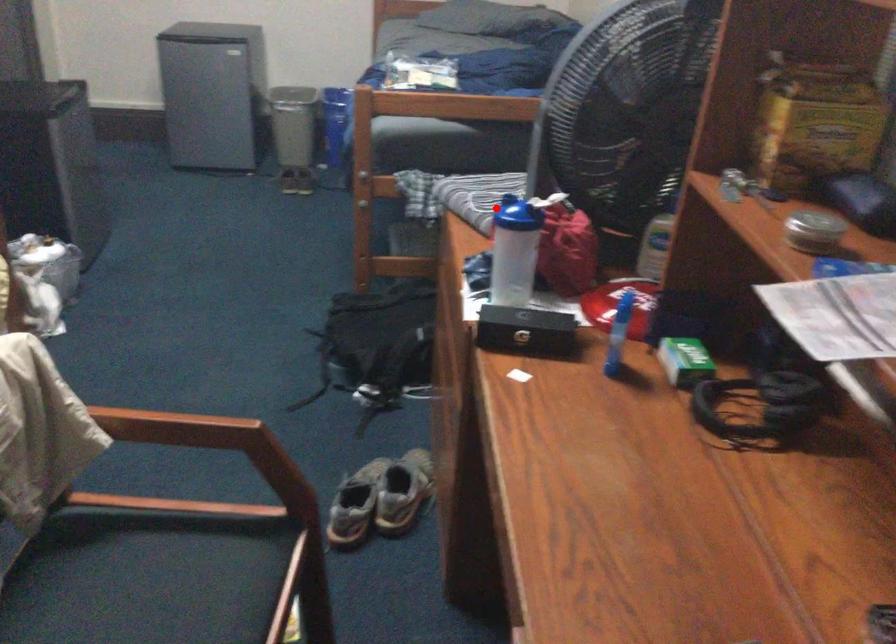
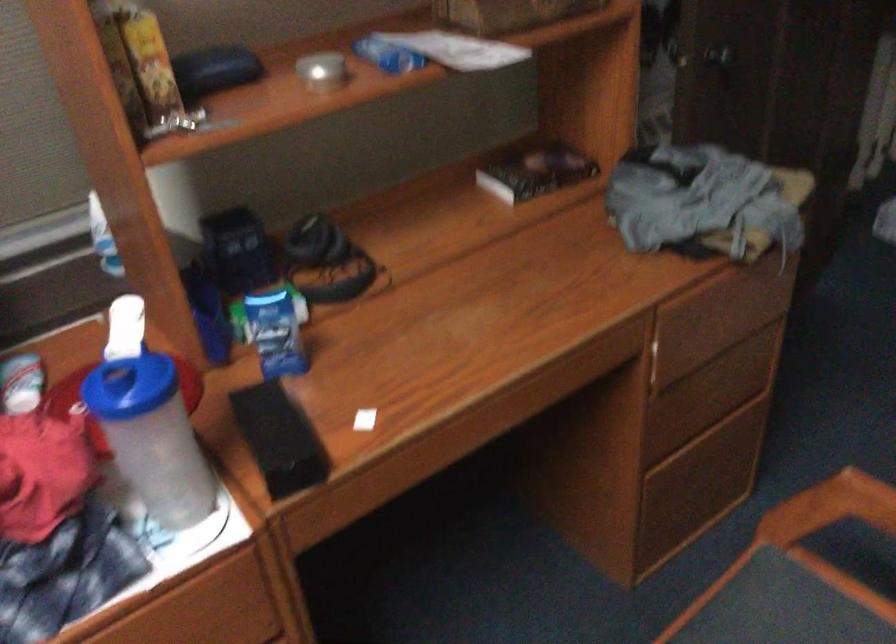
Question: I am providing you with two images of the same scene from different viewpoints. A red point is shown in image1. For the corresponding object point in image2, is it positioned nearer or farther from the camera?

Choices:
 (A) Nearer
 (B) Farther

Answer: (A)